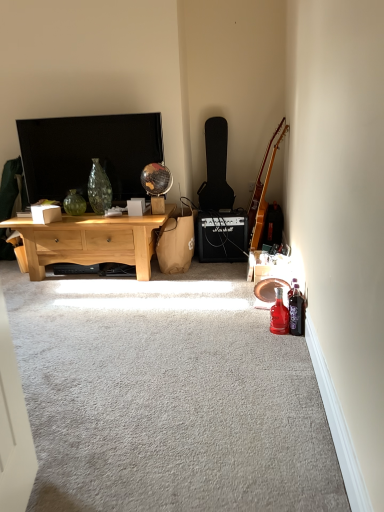
Identify the location of vacant space in front of white matte box at center, acting as the 2th box starting from the left. (137, 215).